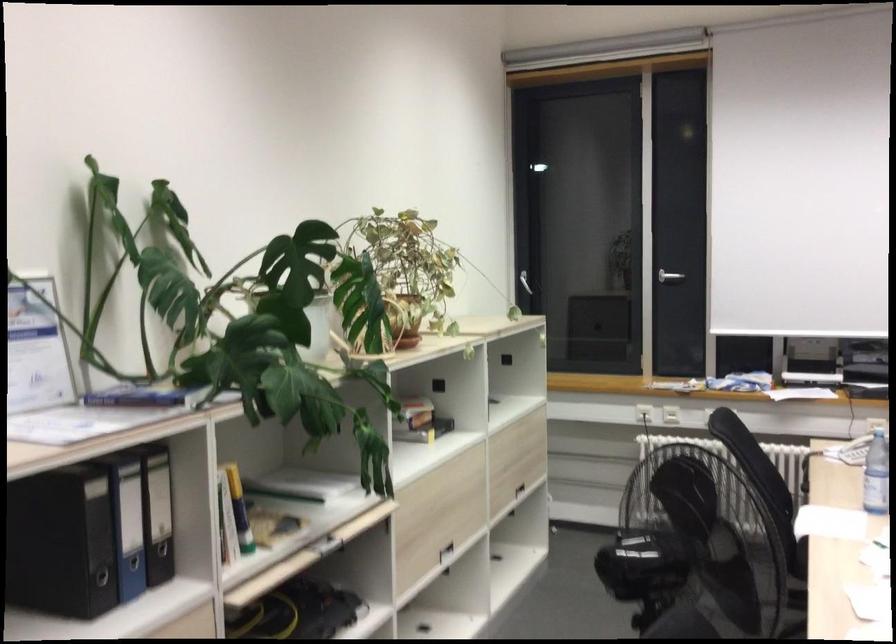
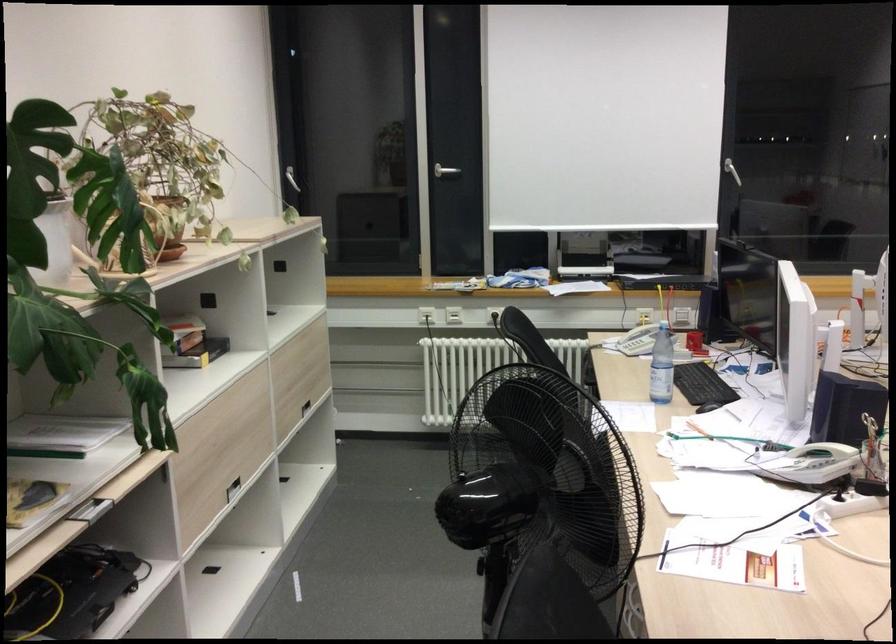
Find the pixel in the second image that matches [670,279] in the first image.

(445, 171)